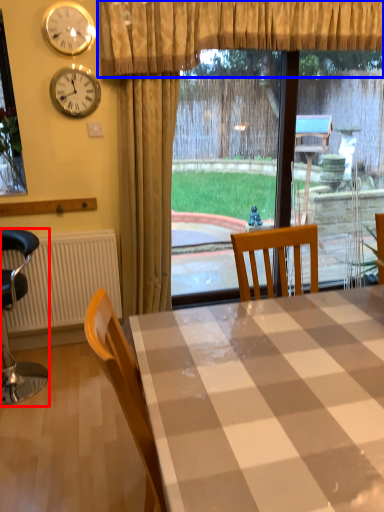
Question: Which object appears farthest to the camera in this image, chair (highlighted by a red box) or curtain (highlighted by a blue box)?

Choices:
 (A) chair
 (B) curtain

Answer: (B)